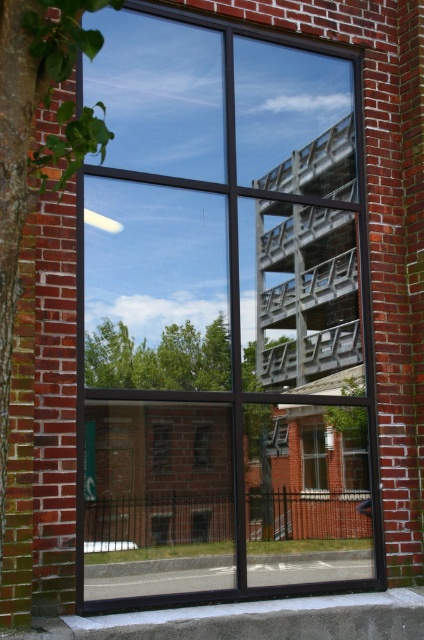
Question: Can you confirm if black glass window at center is positioned to the right of clear glass window at center?

Choices:
 (A) no
 (B) yes

Answer: (A)

Question: Is black glass window at center to the right of clear glass window at center from the viewer's perspective?

Choices:
 (A) yes
 (B) no

Answer: (B)

Question: Which point appears farthest from the camera in this image?

Choices:
 (A) click(211, 564)
 (B) click(306, 484)
 (C) click(3, 61)

Answer: (A)

Question: Which point appears farthest from the camera in this image?

Choices:
 (A) (25, 120)
 (B) (318, 433)
 (C) (136, 195)

Answer: (B)

Question: Among these points, which one is farthest from the camera?

Choices:
 (A) (109, 29)
 (B) (325, 445)

Answer: (B)

Question: Is black glass window at center below clear glass window at center?

Choices:
 (A) no
 (B) yes

Answer: (A)